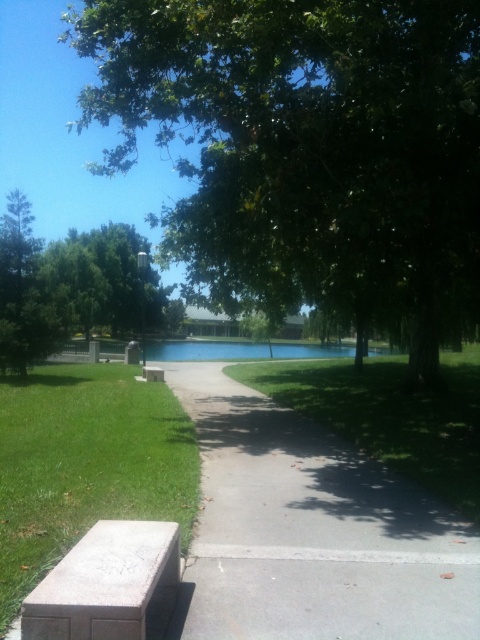
Between gray concrete pavement at center and green leafy tree at upper left, which one appears on the left side from the viewer's perspective?

green leafy tree at upper left

Does gray concrete pavement at center appear over green leafy tree at upper left?

Actually, gray concrete pavement at center is below green leafy tree at upper left.

What do you see at coordinates (312, 531) in the screenshot?
I see `gray concrete pavement at center` at bounding box center [312, 531].

Locate an element on the screen. The image size is (480, 640). gray concrete pavement at center is located at coordinates 312,531.

Measure the distance between gray concrete pavement at center and green grass at center.

gray concrete pavement at center and green grass at center are 5.79 meters apart.

From the picture: Can you confirm if gray concrete pavement at center is positioned above green grass at center?

No.

Between point (382, 468) and point (360, 438), which one is positioned behind?

The point (360, 438) is more distant.

This screenshot has height=640, width=480. In order to click on gray concrete pavement at center in this screenshot , I will do `click(312, 531)`.

Is point (72, 525) closer to camera compared to point (455, 362)?

Yes, point (72, 525) is closer to viewer.

The image size is (480, 640). Identify the location of green grass at lower left. point(85,465).

Where is `green grass at lower left`? green grass at lower left is located at coordinates point(85,465).